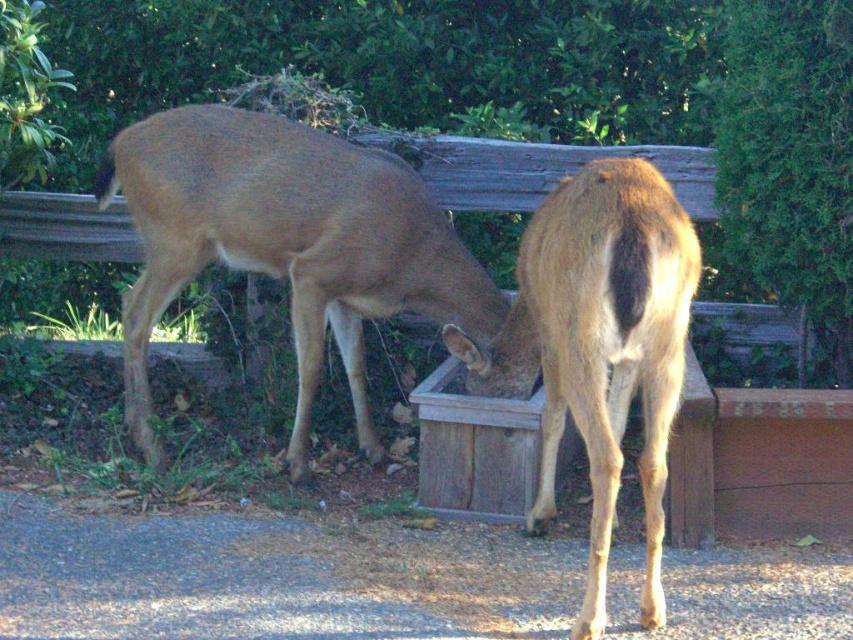
Question: Can you confirm if brown matte deer at center is smaller than brown fur deer at right?

Choices:
 (A) yes
 (B) no

Answer: (A)

Question: Is the position of brown matte deer at center more distant than that of brown fur deer at right?

Choices:
 (A) yes
 (B) no

Answer: (A)

Question: Which of the following is the closest to the observer?

Choices:
 (A) brown fur deer at right
 (B) brown matte deer at center

Answer: (A)

Question: Which point appears farthest from the camera in this image?

Choices:
 (A) (218, 124)
 (B) (608, 480)

Answer: (A)

Question: Does brown matte deer at center have a greater width compared to brown fur deer at right?

Choices:
 (A) yes
 (B) no

Answer: (A)